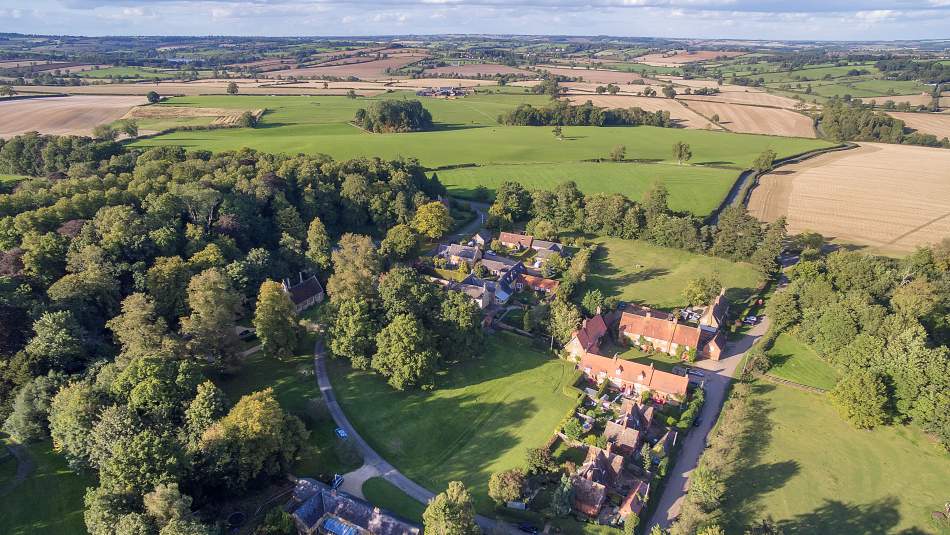
At what (x,y) coordinates should I click in order to perform the action: click on chimney. Please return your answer as a coordinate pair (x, y). This screenshot has height=535, width=950. Looking at the image, I should click on (587, 473), (608, 443), (650, 364).